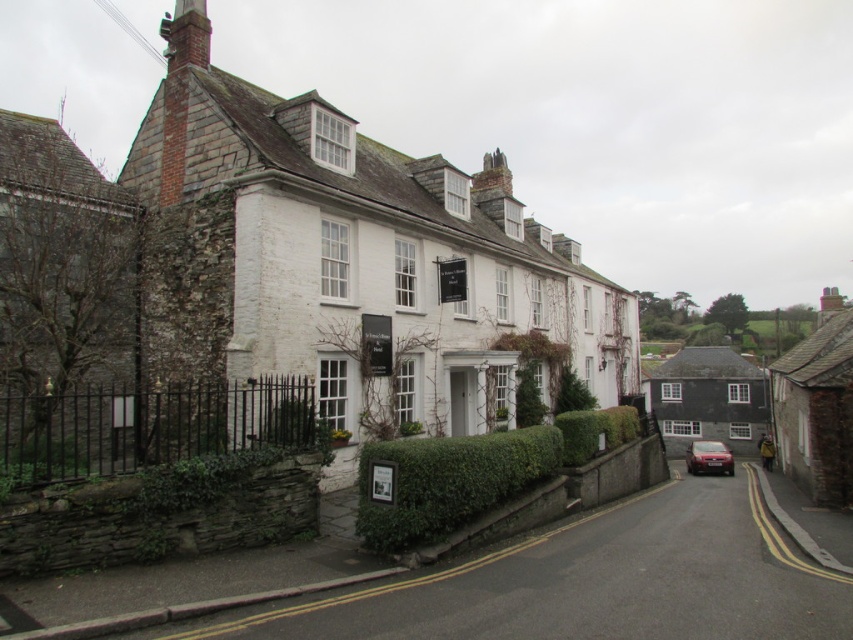
Which of these two, green leafy hedge at lower center or metallic red car at lower right, stands shorter?

green leafy hedge at lower center is shorter.

Between point (390, 548) and point (685, 454), which one is positioned in front?

Point (390, 548) is in front.

Which is in front, point (408, 541) or point (717, 461)?

Point (408, 541) is more forward.

What are the coordinates of `green leafy hedge at lower center` in the screenshot? It's located at (450, 483).

From the picture: Can you confirm if green leafy hedge at lower center is wider than green leafy hedge at center?

Incorrect, green leafy hedge at lower center's width does not surpass green leafy hedge at center's.

Does point (376, 548) come farther from viewer compared to point (585, 452)?

No, it is in front of (585, 452).

Find the location of a particular element. This screenshot has height=640, width=853. green leafy hedge at lower center is located at coordinates (450, 483).

Is point (616, 417) closer to viewer compared to point (703, 448)?

That is True.

Does green leafy hedge at center come behind metallic red car at lower right?

No, it is not.

Locate an element on the screen. green leafy hedge at center is located at coordinates (595, 432).